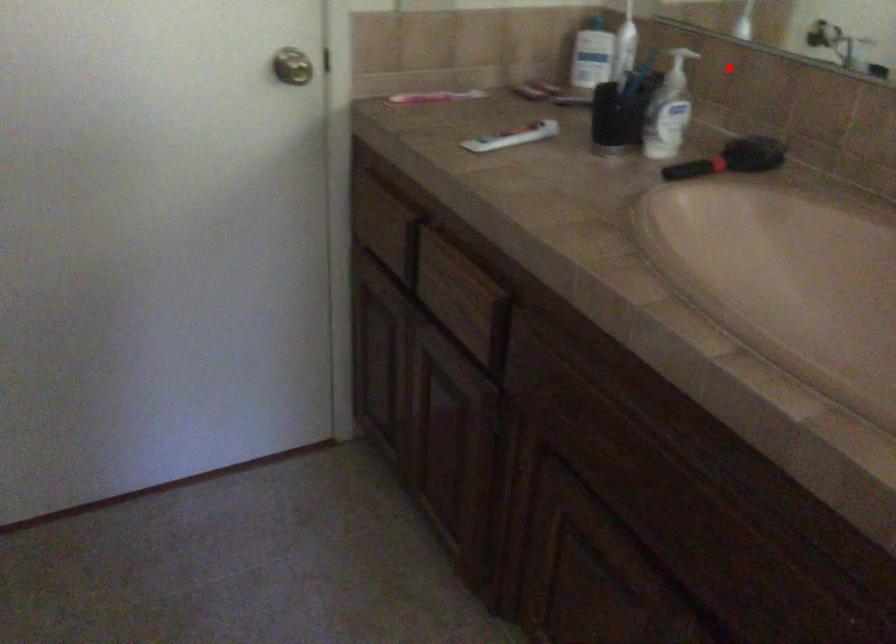
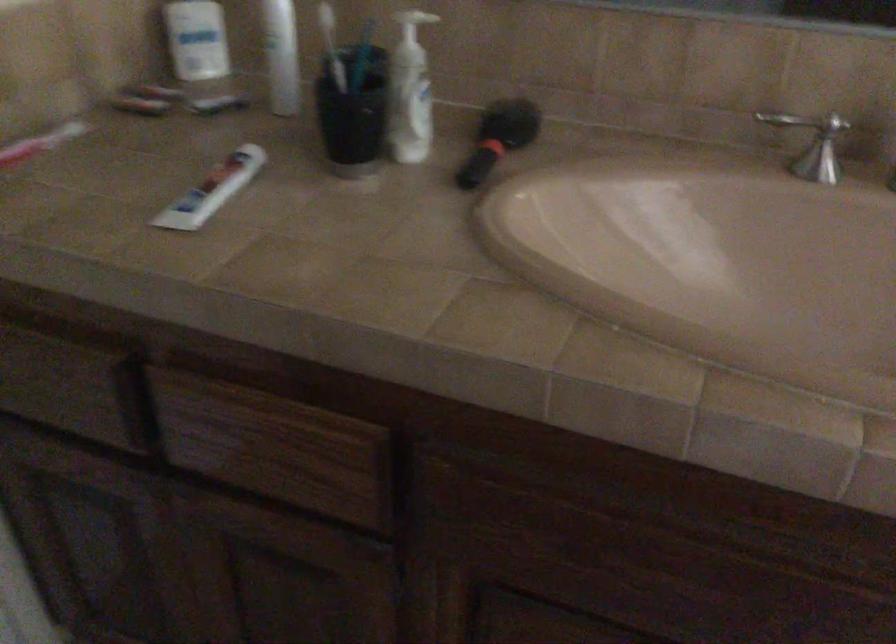
Question: A red point is marked in image1. In image2, is the corresponding 3D point closer to the camera or farther? Reply with the corresponding letter.

Choices:
 (A) The corresponding 3D point is closer.
 (B) The corresponding 3D point is farther.

Answer: (A)